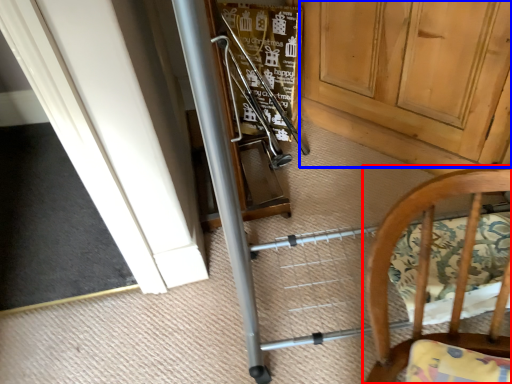
Question: Which object is further to the camera taking this photo, chair (highlighted by a red box) or door (highlighted by a blue box)?

Choices:
 (A) chair
 (B) door

Answer: (B)